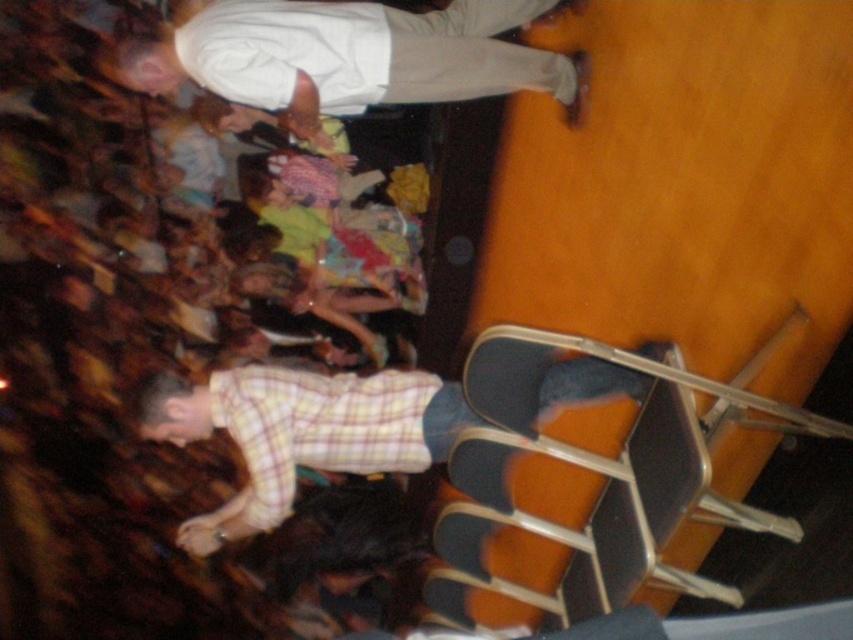
You are a photographer trying to capture both the yellow plaid shirt at center and the yellow plaid shirt at lower left in a single frame. Given their positions, which one would appear higher in your photo?

The yellow plaid shirt at center appears higher in the photo because it is positioned above the yellow plaid shirt at lower left.

You are standing in the dimly lit indoor scene described. You need to locate the yellow plaid shirt at center. Based on the coordinates given, which direction should you look to find it?

The yellow plaid shirt at center is located at coordinates point (300, 433). Since the first coordinate typically represents the horizontal axis and the second the vertical, this places it towards the right and lower middle of the image. Look to your right and slightly downward from the center to find it.